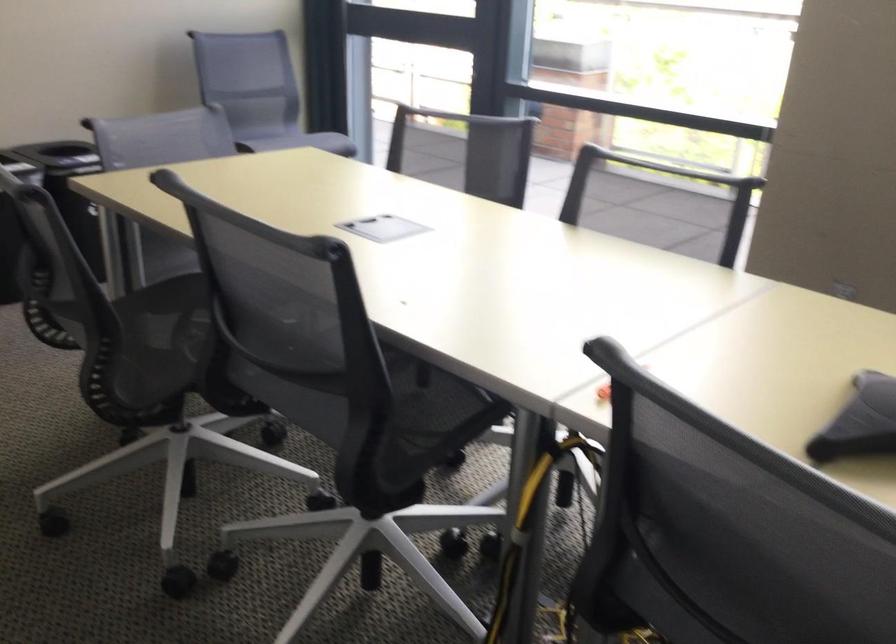
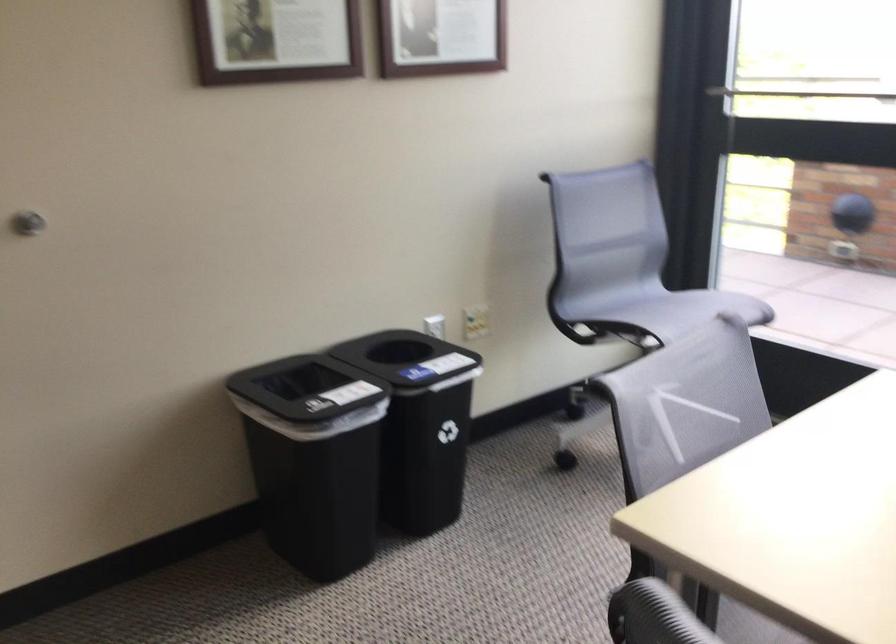
The images are taken continuously from a first-person perspective. In which direction are you moving?

The movement direction of the cameraman is left, forward.